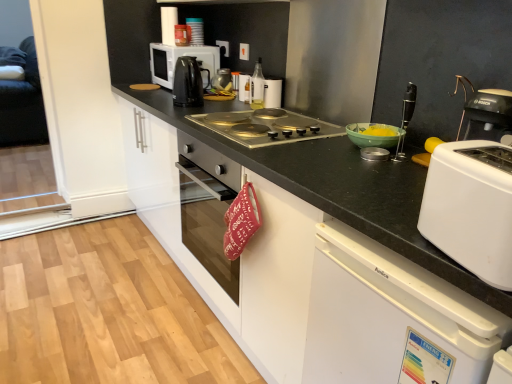
The height and width of the screenshot is (384, 512). Find the location of `vacant space that is to the left of white glossy canister at upper center, which is the first kitchen appliance in right-to-left order`. vacant space that is to the left of white glossy canister at upper center, which is the first kitchen appliance in right-to-left order is located at coordinates (x=238, y=102).